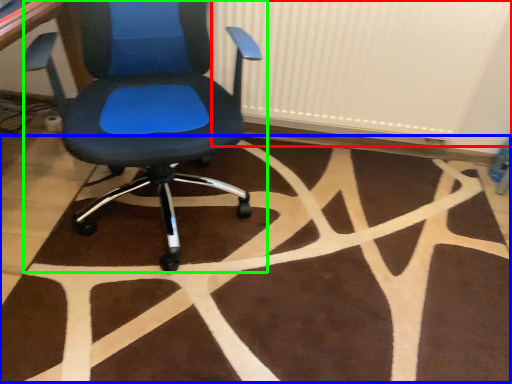
Question: Estimate the real-world distances between objects in this image. Which object is farther from radiator (highlighted by a red box), mat (highlighted by a blue box) or chair (highlighted by a green box)?

Choices:
 (A) mat
 (B) chair

Answer: (A)